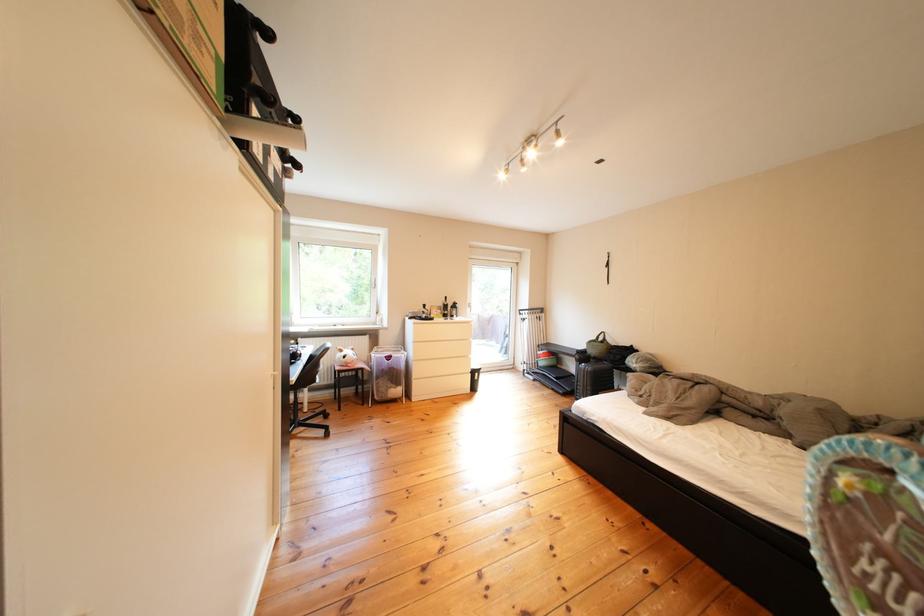
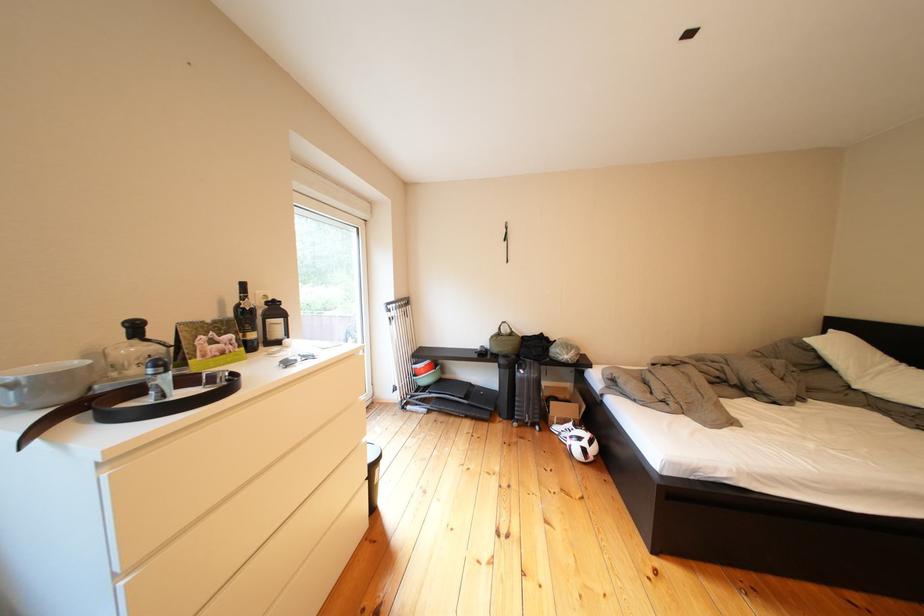
Find the pixel in the second image that matches point 578,371 in the first image.

(462, 381)